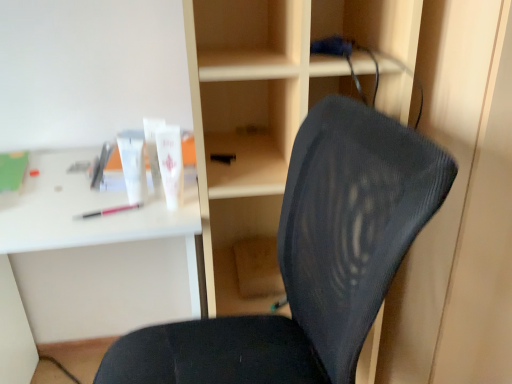
Image resolution: width=512 pixels, height=384 pixels. What are the coordinates of `free point in front of white matte tube at upper left, arranged as the third toiletry when viewed from the right` in the screenshot? It's located at (122, 220).